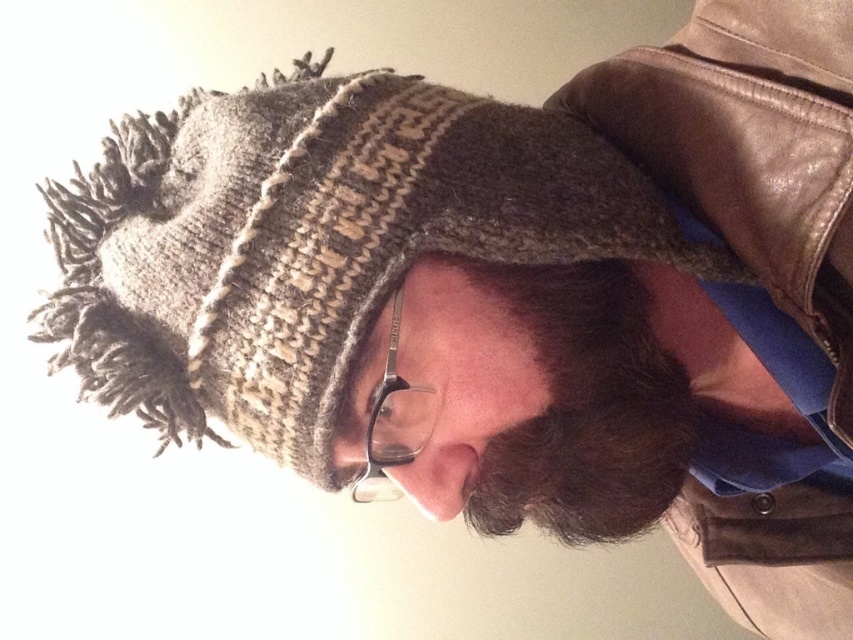
Is point (480, 355) behind point (518, 460)?

No, it is not.

Based on the photo, does fuzzy knit hat at upper center appear under dark brown fuzzy beard at center?

No.

Is point (236, 344) positioned before point (520, 454)?

Yes, point (236, 344) is closer to viewer.

Image resolution: width=853 pixels, height=640 pixels. Find the location of `fuzzy knit hat at upper center`. fuzzy knit hat at upper center is located at coordinates (390, 298).